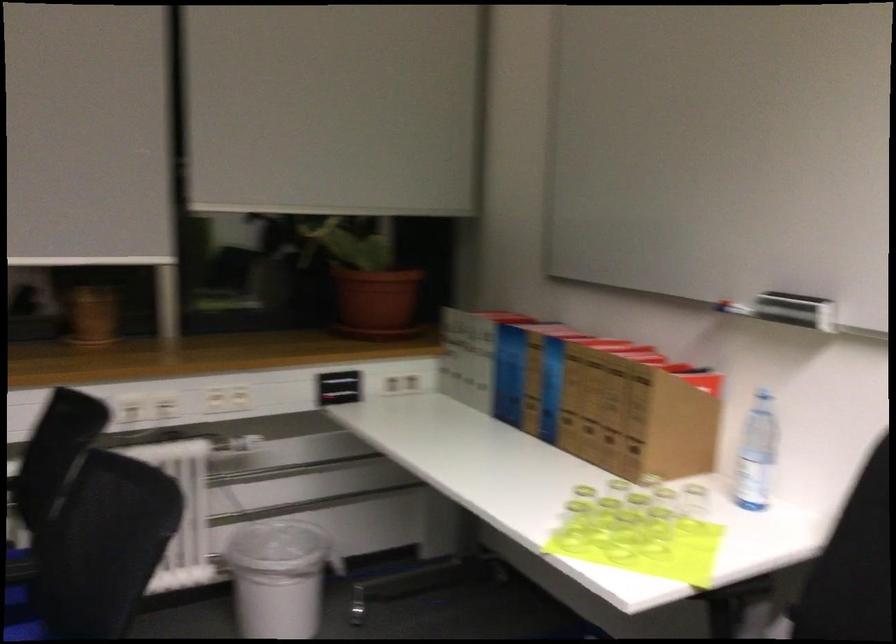
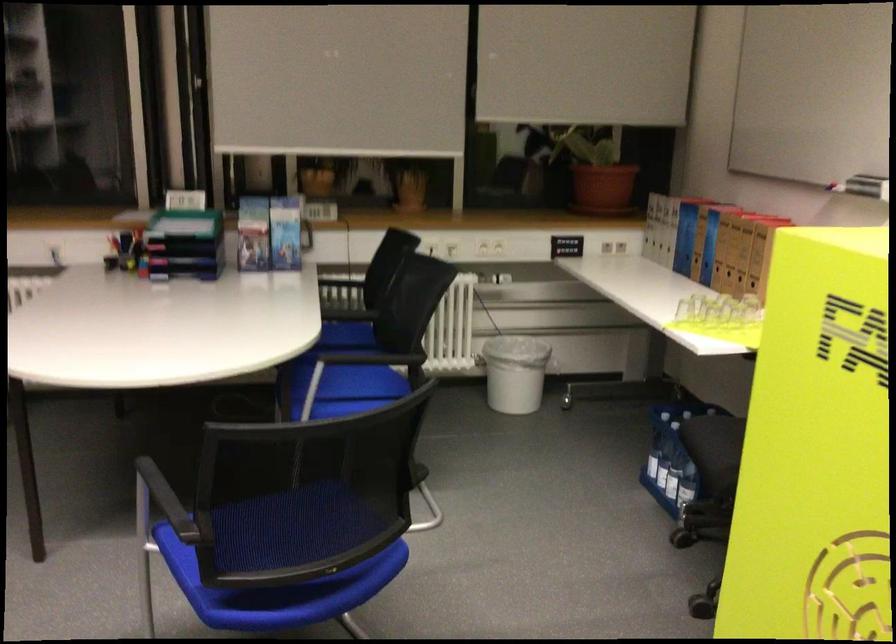
Find the pixel in the second image that matches point (614, 395) in the first image.

(746, 243)